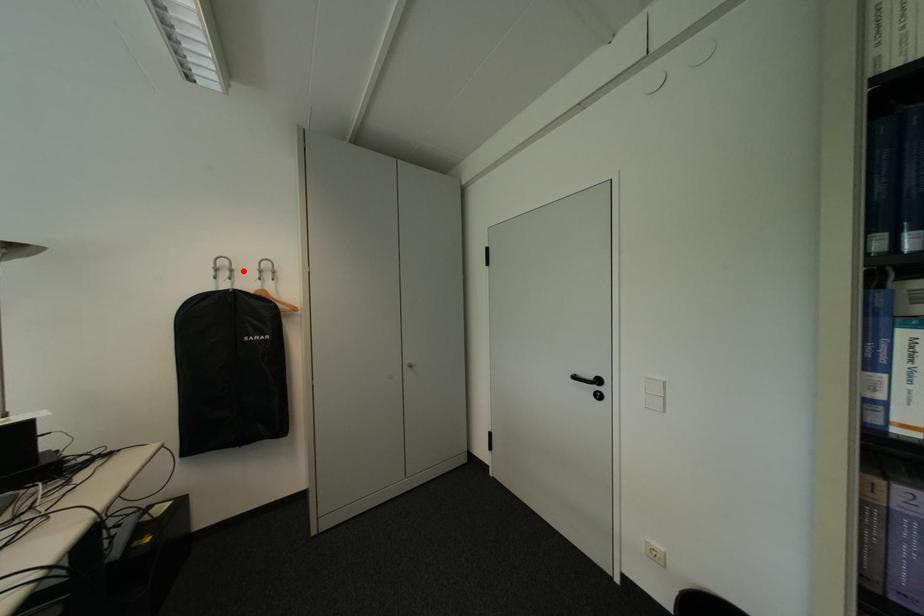
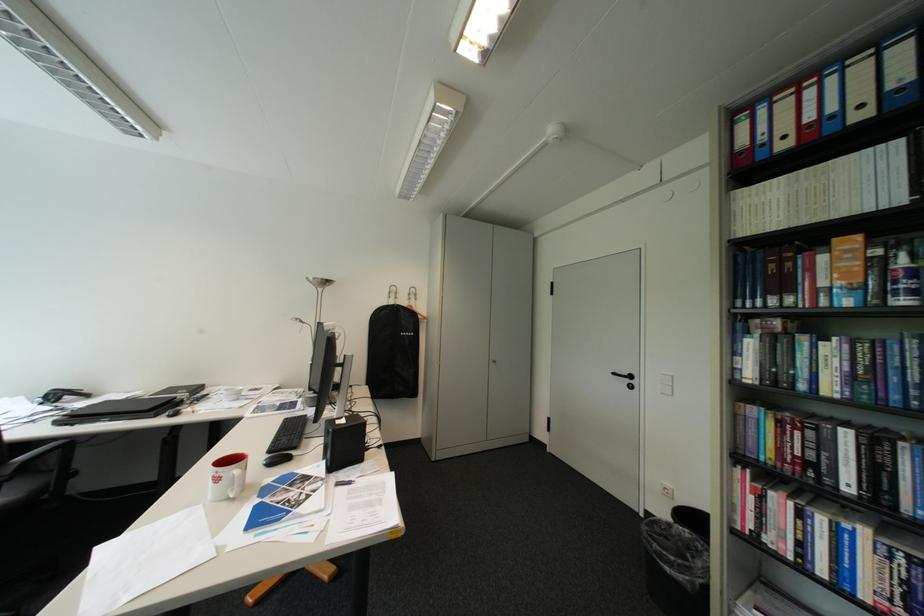
Locate, in the second image, the point that corresponds to the highlighted location in the first image.

(408, 294)